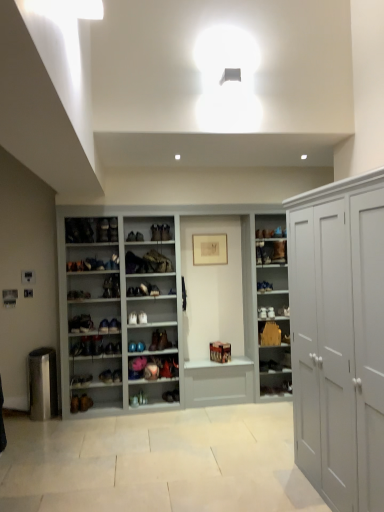
Question: From the image's perspective, is matte brown shoe at center, which is counted as the fourth shoe, starting from the bottom, above or below shiny brown leather shoe at center, which ranks as the third shoe in bottom-to-top order?

Choices:
 (A) above
 (B) below

Answer: (A)

Question: Is matte brown shoe at center, the 7th shoe in the top-to-bottom sequence, inside the boundaries of shiny brown leather shoe at center, which ranks as the third shoe in bottom-to-top order, or outside?

Choices:
 (A) inside
 (B) outside

Answer: (B)

Question: Estimate the real-world distances between objects in this image. Which object is farther from the matte brown boot at center, placed as the third shoe when sorted from top to bottom?

Choices:
 (A) matte white shoe at center, the sixth shoe when ordered from bottom to top
 (B) matte brown shoe at center, the 7th shoe in the top-to-bottom sequence
 (C) matte black shoe at center, the ninth shoe when ordered from top to bottom
 (D) brown leather shoe at center, which appears as the 2th footwear when viewed from the right
 (E) matte brown shoe at center, the 5th shoe in the bottom-to-top sequence

Answer: (D)

Question: Estimate the real-world distances between objects in this image. Which object is farther from the matte brown boot at center, arranged as the first footwear when viewed from the right?

Choices:
 (A) matte brown shoe at center, the 5th shoe in the bottom-to-top sequence
 (B) brown leather shoe at center, which is counted as the 2th footwear, starting from the left
 (C) wooden cabinet at center
 (D) shiny brown leather shoe at center, placed as the 4th shoe when sorted from top to bottom
 (E) matte black shoe at center, placed as the second shoe when sorted from bottom to top

Answer: (E)